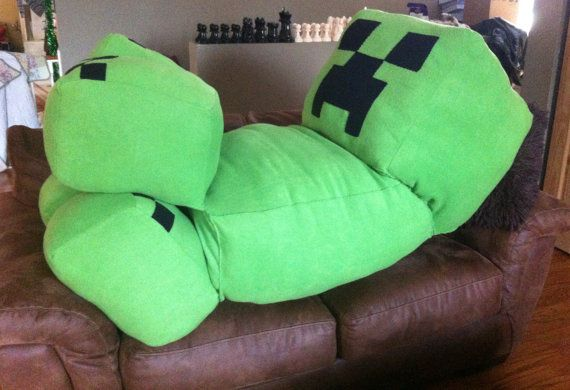
Identify the location of door frame. The height and width of the screenshot is (390, 570). (557, 141).